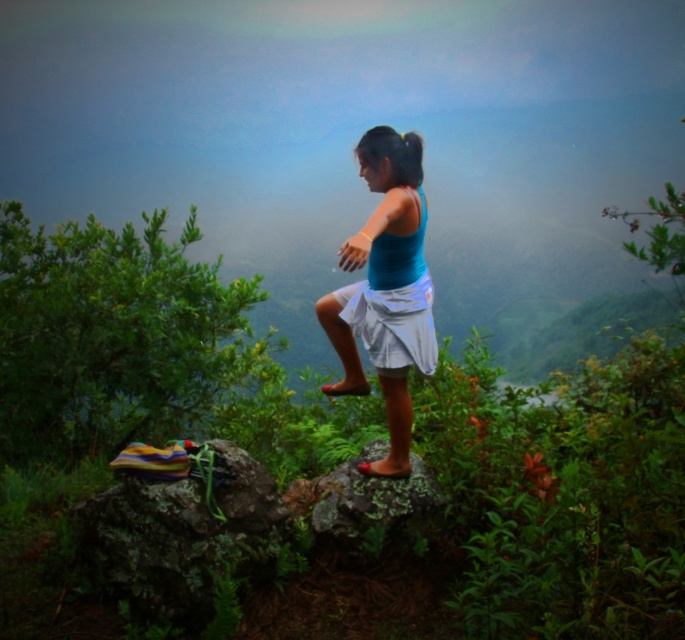
Who is more distant from viewer, (127,374) or (351,540)?

The point (127,374) is behind.

Can you confirm if green leafy bush at center is shorter than green mossy rock at center?

Yes, green leafy bush at center is shorter than green mossy rock at center.

Image resolution: width=685 pixels, height=640 pixels. I want to click on green leafy bush at center, so click(x=566, y=483).

Who is higher up, multicolored fabric at center or green mossy rock at center?

green mossy rock at center is higher up.

Identify the location of multicolored fabric at center. (179, 524).

You are a GUI agent. You are given a task and a screenshot of the screen. Output one action in this format:
    pyautogui.click(x=<x>, y=<y>)
    Task: Click on the multicolored fabric at center
    The height and width of the screenshot is (640, 685).
    Given the screenshot: What is the action you would take?
    pyautogui.click(x=179, y=524)

Is green leafy bush at center to the right of multicolored fabric at center from the viewer's perspective?

Indeed, green leafy bush at center is positioned on the right side of multicolored fabric at center.

Can you confirm if green leafy bush at center is taller than multicolored fabric at center?

Incorrect, green leafy bush at center's height is not larger of multicolored fabric at center's.

The width and height of the screenshot is (685, 640). In order to click on green leafy bush at center in this screenshot , I will do `click(566, 483)`.

This screenshot has width=685, height=640. What are the coordinates of `green leafy bush at center` in the screenshot? It's located at (566, 483).